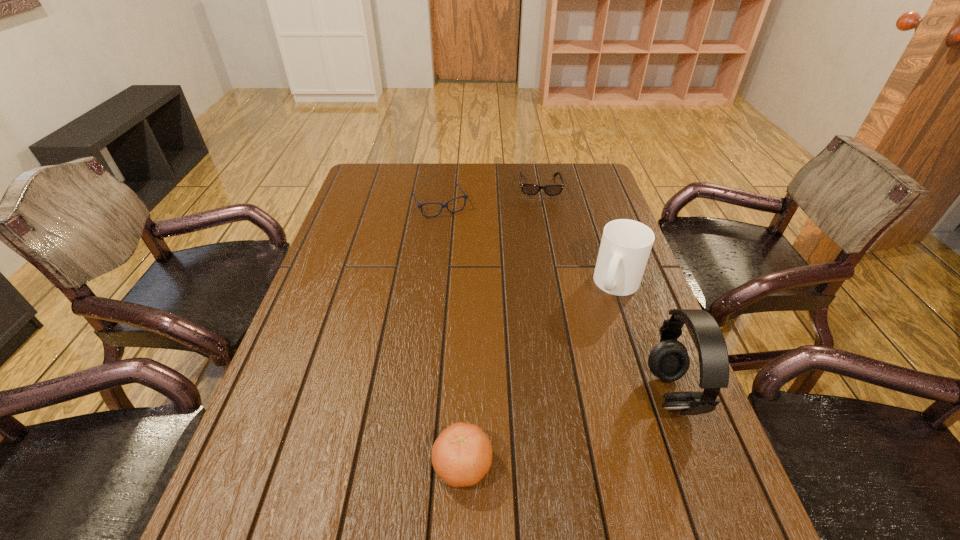
I want to click on vacant space located 0.220m on the lenses of the third object from right to left, so click(545, 239).

At what (x,y) coordinates should I click in order to perform the action: click on free spot located 0.230m on the lenses of the third object from right to left. Please return your answer as a coordinate pair (x, y). Looking at the image, I should click on (545, 240).

At what (x,y) coordinates should I click in order to perform the action: click on vacant area situated on the lenses of the third object from right to left. Please return your answer as a coordinate pair (x, y). Looking at the image, I should click on (543, 218).

I want to click on free region located 0.210m on the front-facing side of the left spectacles, so coord(470,256).

At what (x,y) coordinates should I click in order to perform the action: click on free space located on the front-facing side of the left spectacles. Please return your answer as a coordinate pair (x, y). Looking at the image, I should click on (475, 264).

Find the location of a particular element. The width and height of the screenshot is (960, 540). vacant space located 0.280m on the front-facing side of the left spectacles is located at coordinates (478, 271).

In order to click on object that is at the near edge in this screenshot , I will do `click(462, 454)`.

At what (x,y) coordinates should I click in order to perform the action: click on earphone present at the right edge. Please return your answer as a coordinate pair (x, y). This screenshot has width=960, height=540. Looking at the image, I should click on (669, 361).

Image resolution: width=960 pixels, height=540 pixels. What are the coordinates of `mug positioned at the right edge` in the screenshot? It's located at (625, 247).

This screenshot has width=960, height=540. Identify the location of spectacles that is positioned at the right edge. (528, 189).